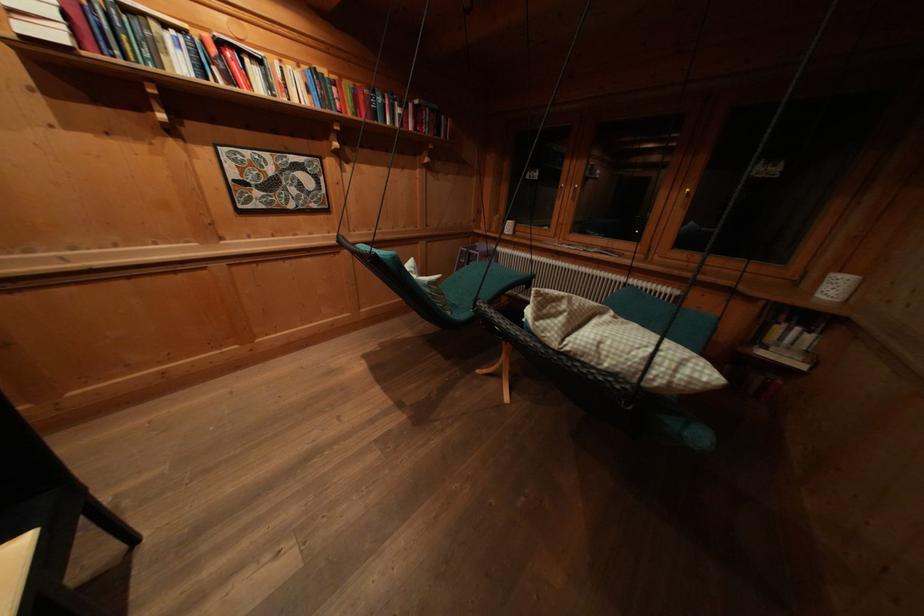
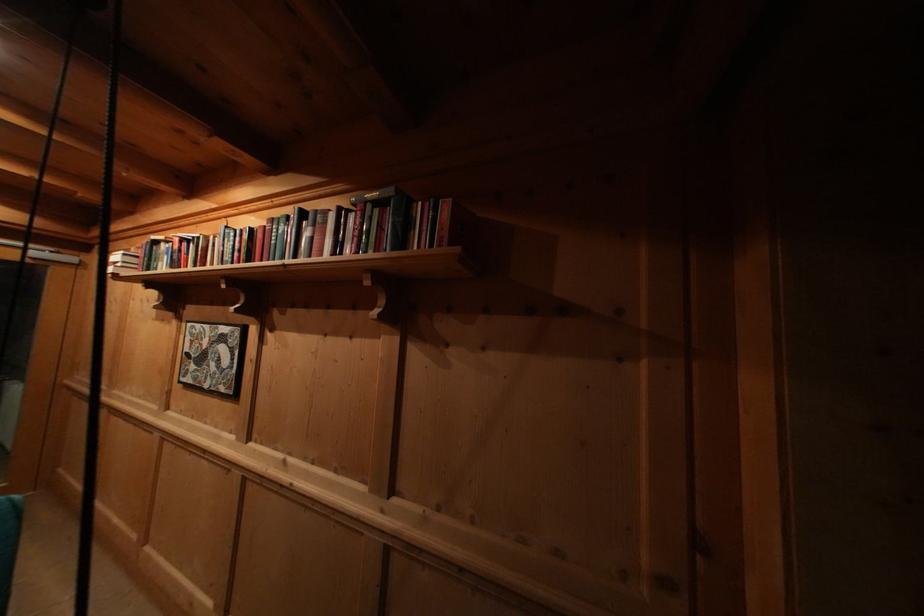
Locate, in the second image, the point that corresponds to point (225, 47) in the first image.

(188, 246)